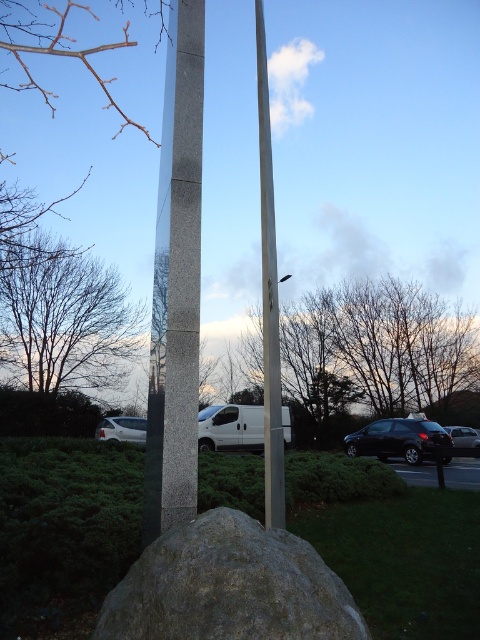
You are standing in the scene and want to take a photo of the shiny black car at lower right without the polished granite pole at center blocking the view. Is this possible?

The polished granite pole at center is located above the shiny black car at lower right, so you can take a photo of the shiny black car at lower right by positioning yourself below the pole to avoid blocking the view.

You are standing at the center of the image and want to place a small decorative item on the polished granite pole at center. What are the coordinates where you should place it?

The coordinates for the polished granite pole at center are at point (x=176, y=282), so you should place the item there.

You are a photographer trying to capture both the polished metal flag pole at center and the white matte van at lower left in the same frame. Since you want to emphasize the size difference between them, which object should you position closer to the camera to make the smaller one appear larger in the photo?

To emphasize the size difference, you should position the polished metal flag pole at center closer to the camera since it has a lesser width compared to the white matte van at lower left. This will make the smaller flag pole appear larger relative to the van in the photo.